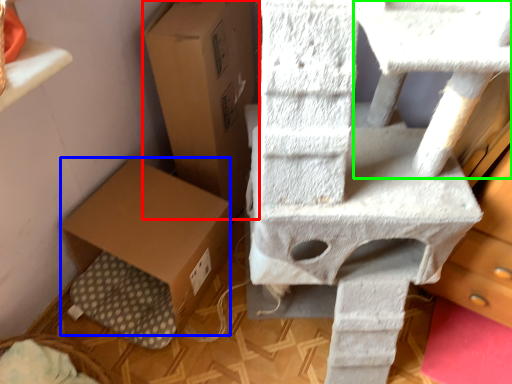
Question: Which is nearer to the cardboard box (highlighted by a red box)? cardboard box (highlighted by a blue box) or table (highlighted by a green box).

Choices:
 (A) cardboard box
 (B) table

Answer: (A)